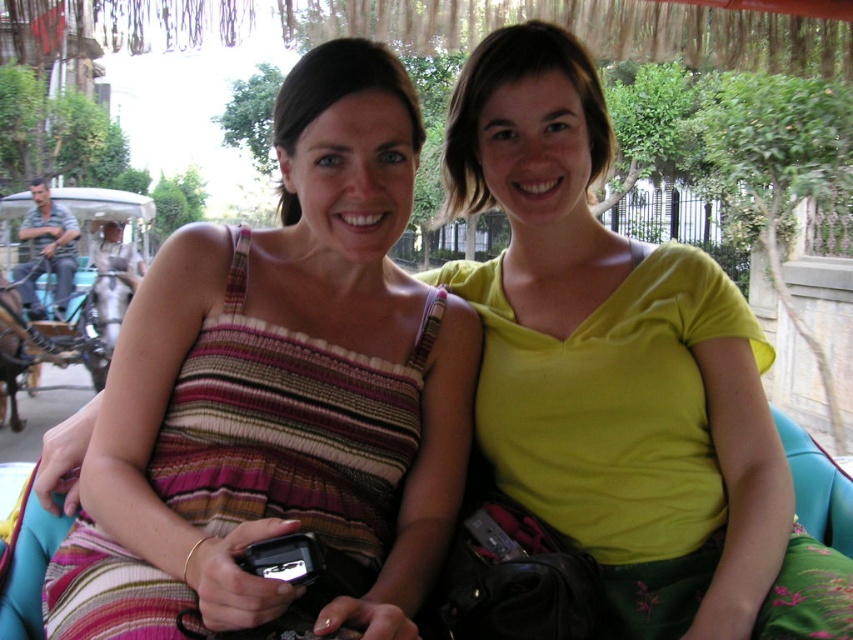
From the picture: You are a photographer trying to capture both the yellow matte shirt at center and the brushed metal coach at left in a single frame. Given their sizes, which object should you focus on to ensure both are clearly visible in the photo?

The yellow matte shirt at center is smaller than the brushed metal coach at left, so focusing on the larger brushed metal coach at left will help ensure both objects are visible in the frame.

You are a photographer trying to capture a candid shot of the striped fabric dress at center without the subject noticing. You have a camera with a 3.5 feet focal length. Can you take the photo from your current position?

The striped fabric dress at center and the camera are 3.59 feet apart from each other. Since the camera has a 3.5 feet focal length, it is just slightly shorter than the distance. You might need to move a bit closer or use a different lens to ensure the subject fills the frame properly.

You are standing in the park and see two people sitting. There is a point at coordinates (x=622, y=371). What object is located at that point?

The yellow matte shirt at center is located at point (x=622, y=371).